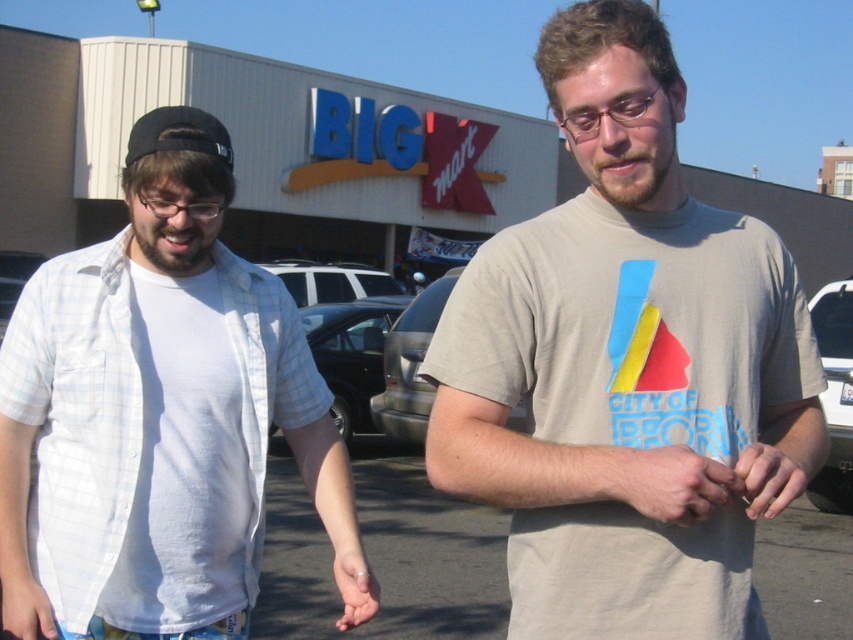
Which is more to the left, smooth beige shirt at center or white matte hand at lower left?

Positioned to the left is white matte hand at lower left.

Which is in front, point (683, 509) or point (0, 614)?

Point (683, 509) is more forward.

You are a GUI agent. You are given a task and a screenshot of the screen. Output one action in this format:
    pyautogui.click(x=<x>, y=<y>)
    Task: Click on the smooth beige shirt at center
    
    Given the screenshot: What is the action you would take?
    (668, 483)

Which is above, smooth beige shirt at center or smooth skin hand at center?

smooth skin hand at center is higher up.

In order to click on smooth beige shirt at center in this screenshot , I will do `click(668, 483)`.

Who is more distant from viewer, (711, 508) or (759, 493)?

The point (759, 493) is more distant.

Where is `smooth beige shirt at center`? smooth beige shirt at center is located at coordinates (668, 483).

Does light beige t-shirt at center lie in front of smooth beige shirt at center?

That is False.

Does light beige t-shirt at center appear on the left side of smooth beige shirt at center?

Incorrect, light beige t-shirt at center is not on the left side of smooth beige shirt at center.

Does point (543, 268) lie behind point (469, 490)?

Yes, it is.

This screenshot has width=853, height=640. In order to click on light beige t-shirt at center in this screenshot , I will do `click(619, 356)`.